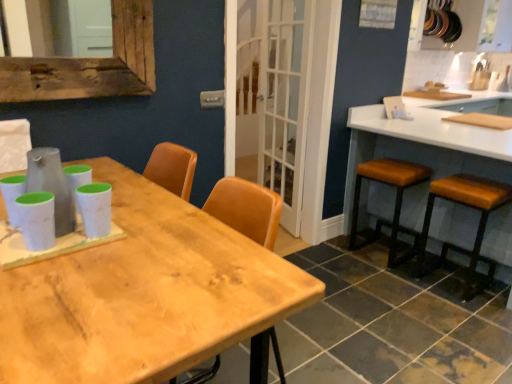
I want to click on vacant area situated to the left side of brown leather stool at right, the second stool viewed from the left, so click(406, 291).